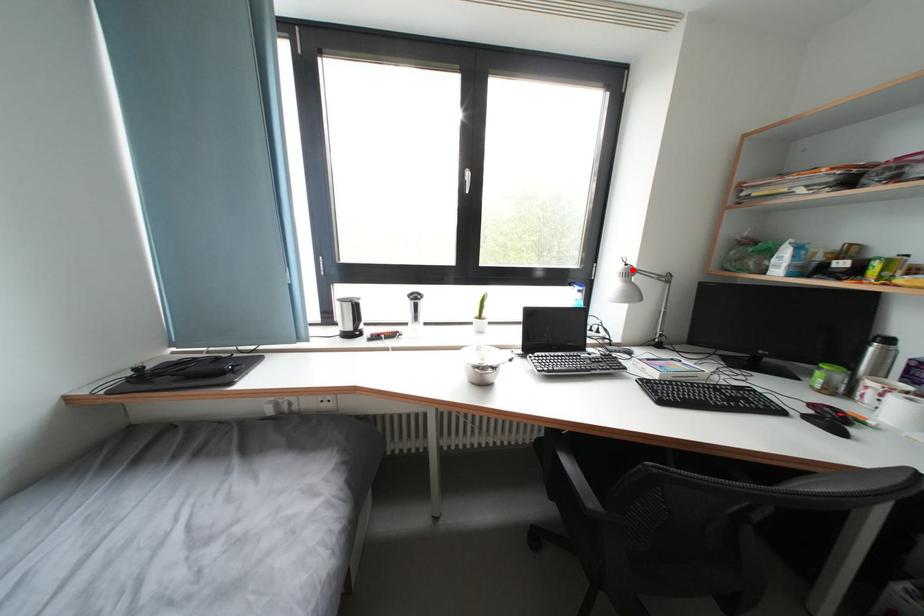
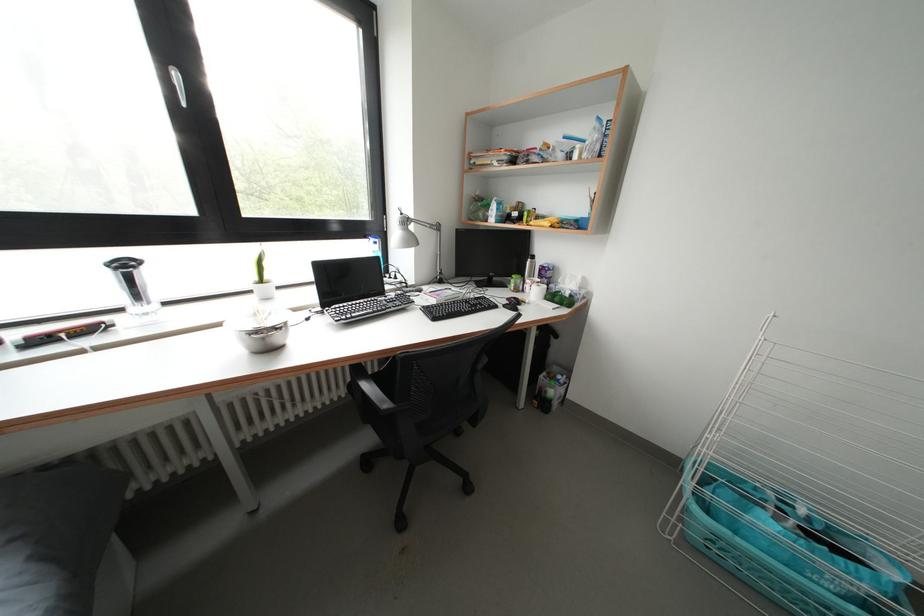
Question: I am providing you with two images of the same scene from different viewpoints. In image1, a red point is highlighted. Considering the same 3D point in image2, which of the following is correct?

Choices:
 (A) It is closer
 (B) It is farther

Answer: (A)